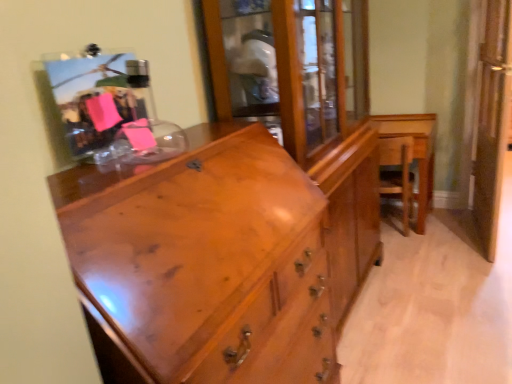
Question: Visually, is wooden armchair at right positioned to the left or to the right of shiny brown wood chest of drawers at center?

Choices:
 (A) right
 (B) left

Answer: (A)

Question: Does point (409, 177) appear closer or farther from the camera than point (327, 284)?

Choices:
 (A) farther
 (B) closer

Answer: (A)

Question: Which object is positioned closest to the clear glass screen door at right?

Choices:
 (A) wooden table at right
 (B) shiny brown wood chest of drawers at center
 (C) wooden armchair at right

Answer: (A)

Question: Estimate the real-world distances between objects in this image. Which object is farther from the shiny brown wood chest of drawers at center?

Choices:
 (A) wooden table at right
 (B) wooden armchair at right
 (C) clear glass screen door at right

Answer: (A)